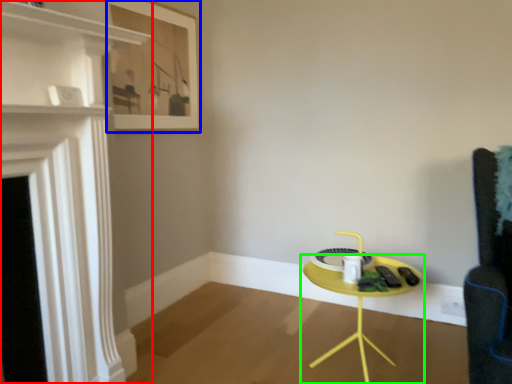
Question: Based on their relative distances, which object is nearer to fireplace (highlighted by a red box)? Choose from picture frame (highlighted by a blue box) and table (highlighted by a green box).

Choices:
 (A) picture frame
 (B) table

Answer: (A)